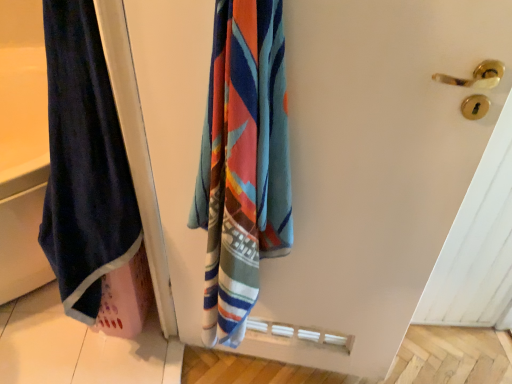
Image resolution: width=512 pixels, height=384 pixels. In order to click on free spot below velvet dark blue towel at left (from a real-world perspective) in this screenshot , I will do `click(264, 368)`.